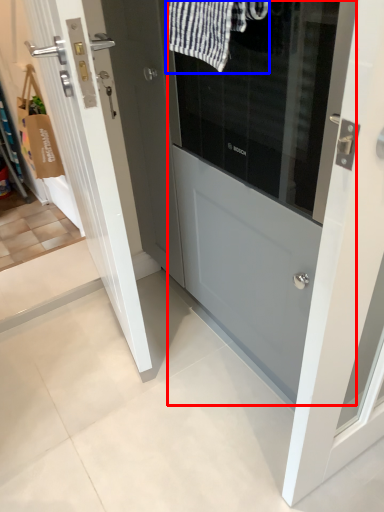
Question: Which object appears closest to the camera in this image, door (highlighted by a red box) or bath towel (highlighted by a blue box)?

Choices:
 (A) door
 (B) bath towel

Answer: (A)